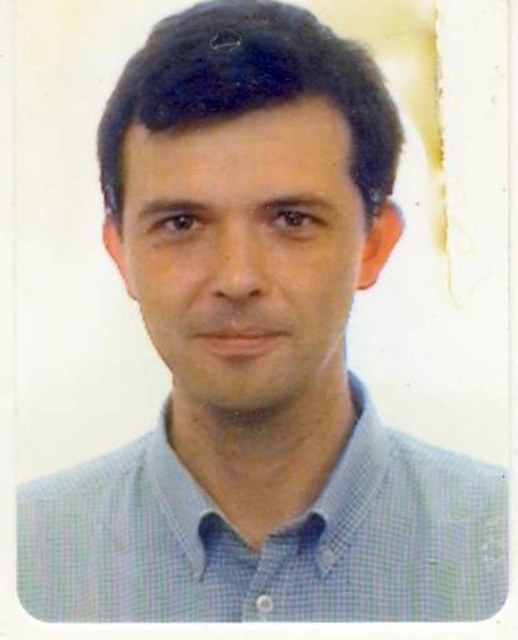
Question: Which point is farther from the camera taking this photo?

Choices:
 (A) (103, 602)
 (B) (333, 339)

Answer: (B)

Question: Where is blue checkered dress shirt at center located in relation to matte blue shirt at center in the image?

Choices:
 (A) below
 (B) above

Answer: (A)

Question: Does blue checkered dress shirt at center have a larger size compared to matte blue shirt at center?

Choices:
 (A) yes
 (B) no

Answer: (A)

Question: Is blue checkered dress shirt at center in front of matte blue shirt at center?

Choices:
 (A) yes
 (B) no

Answer: (A)

Question: Which point is farther to the camera?

Choices:
 (A) matte blue shirt at center
 (B) blue checkered dress shirt at center

Answer: (A)

Question: Which point is farther to the camera?

Choices:
 (A) blue checkered dress shirt at center
 (B) matte blue shirt at center

Answer: (B)